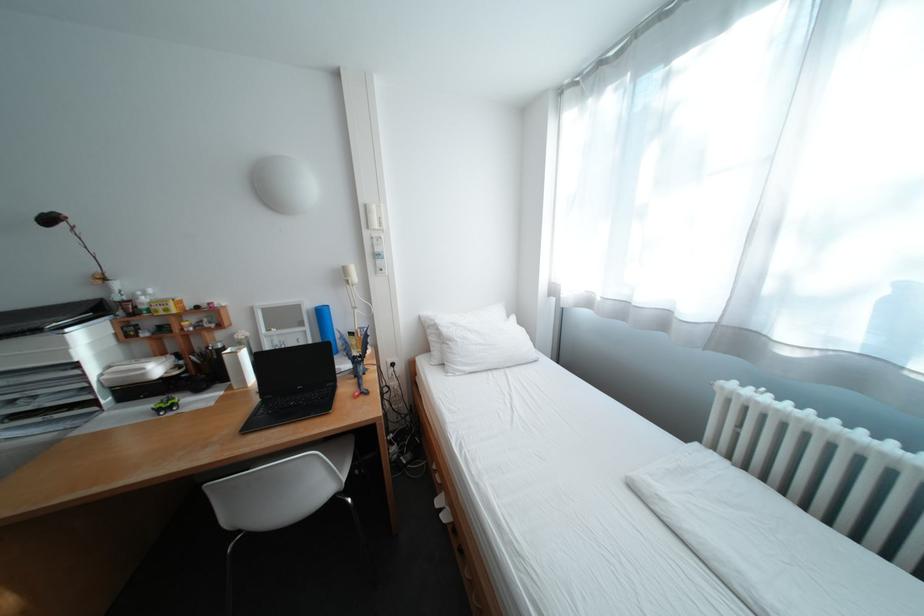
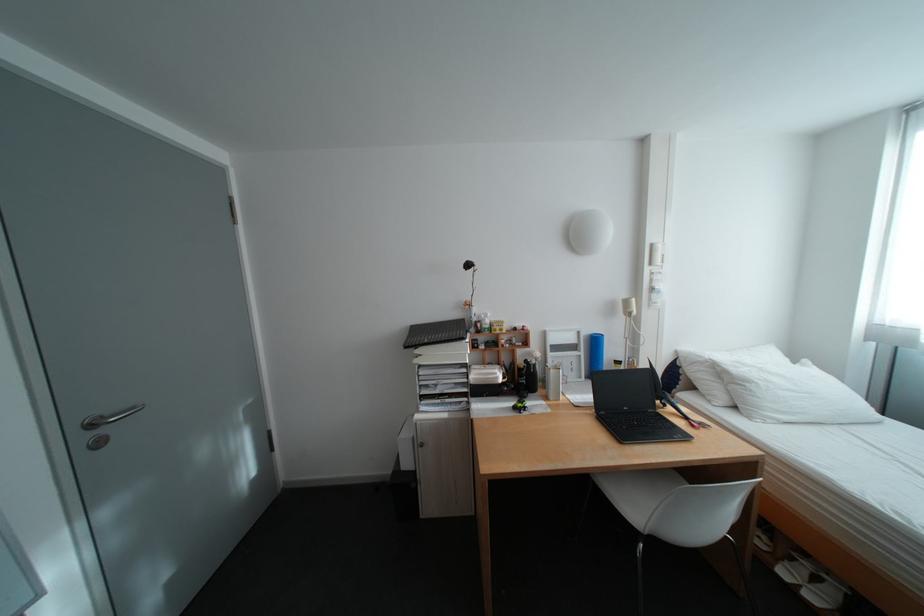
Where in the second image is the point corresponding to point 91,363 from the first image?

(480, 363)